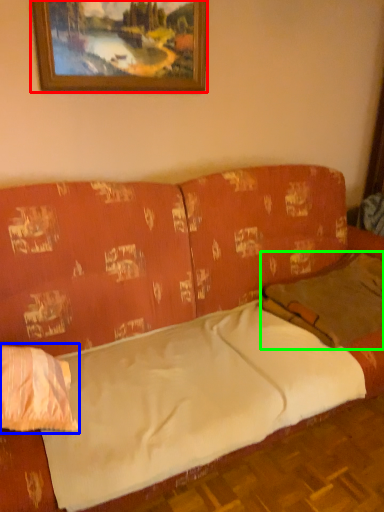
Question: Considering the real-world distances, which object is closest to picture frame (highlighted by a red box)? pillow (highlighted by a blue box) or pillow (highlighted by a green box).

Choices:
 (A) pillow
 (B) pillow

Answer: (B)